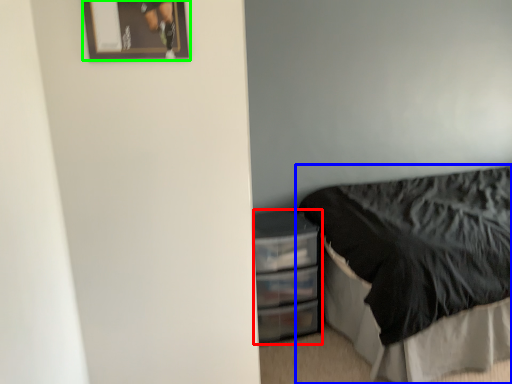
Question: Which is nearer to the file cabinet (highlighted by a red box)? bed (highlighted by a blue box) or picture frame (highlighted by a green box).

Choices:
 (A) bed
 (B) picture frame

Answer: (A)